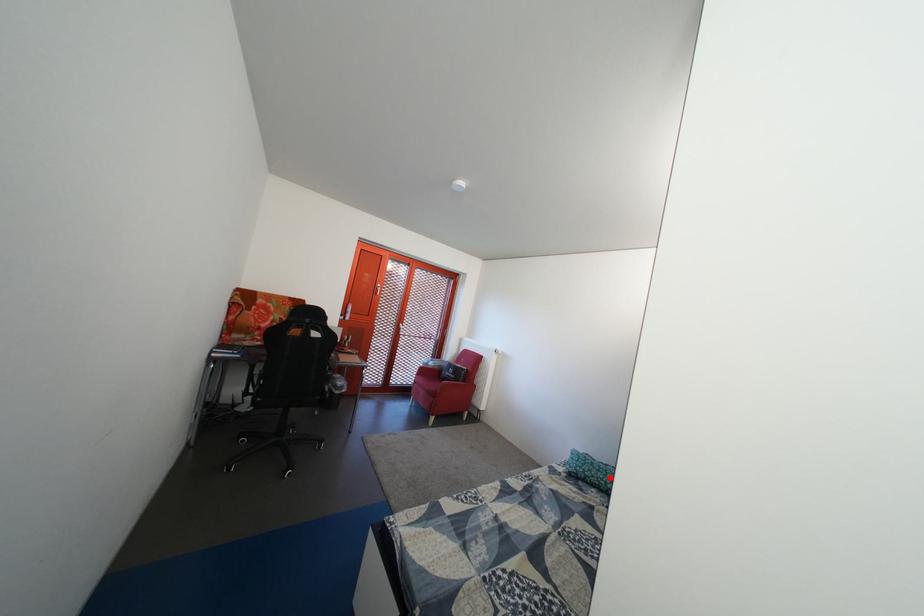
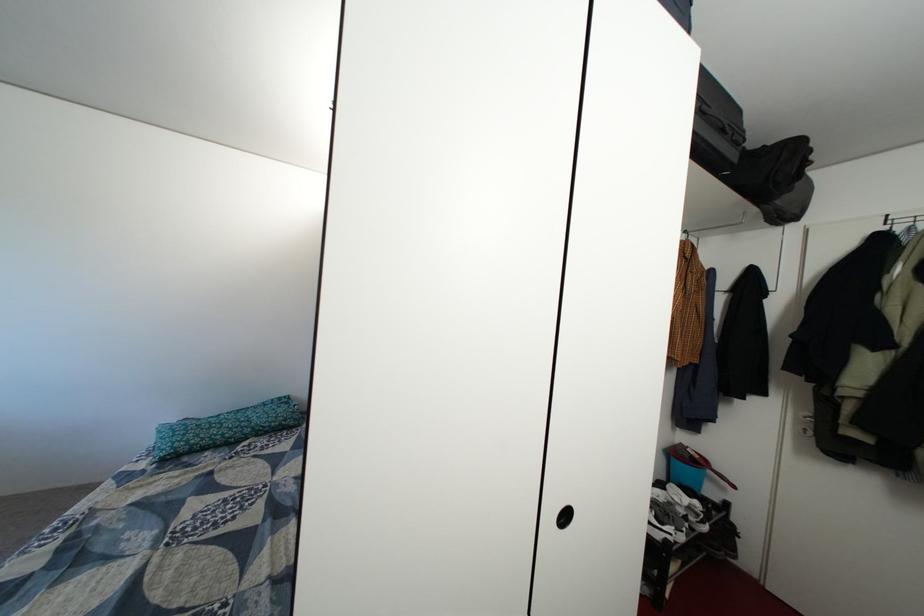
Locate, in the second image, the point that corresponds to the highlighted location in the first image.

(222, 435)